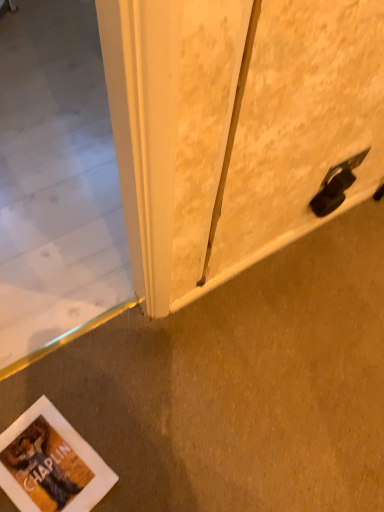
Question: Is white matte concrete at lower left positioned before matte white screen door at right?

Choices:
 (A) yes
 (B) no

Answer: (B)

Question: Would you say matte white screen door at right is part of white matte concrete at lower left's contents?

Choices:
 (A) no
 (B) yes

Answer: (A)

Question: From the image's perspective, is white matte concrete at lower left below matte white screen door at right?

Choices:
 (A) no
 (B) yes

Answer: (B)

Question: Is white matte concrete at lower left not inside matte white screen door at right?

Choices:
 (A) yes
 (B) no

Answer: (A)

Question: Can you confirm if white matte concrete at lower left is smaller than matte white screen door at right?

Choices:
 (A) yes
 (B) no

Answer: (B)

Question: Is white matte concrete at lower left shorter than matte white screen door at right?

Choices:
 (A) yes
 (B) no

Answer: (A)

Question: From the image's perspective, does matte white screen door at right appear higher than white matte concrete at lower left?

Choices:
 (A) yes
 (B) no

Answer: (A)

Question: Considering the relative sizes of matte white screen door at right and white matte concrete at lower left in the image provided, is matte white screen door at right shorter than white matte concrete at lower left?

Choices:
 (A) no
 (B) yes

Answer: (A)

Question: Is matte white screen door at right not near white matte concrete at lower left?

Choices:
 (A) no
 (B) yes

Answer: (A)

Question: Can you confirm if matte white screen door at right is taller than white matte concrete at lower left?

Choices:
 (A) no
 (B) yes

Answer: (B)

Question: From a real-world perspective, is matte white screen door at right positioned over white matte concrete at lower left based on gravity?

Choices:
 (A) yes
 (B) no

Answer: (A)

Question: Is matte white screen door at right looking in the opposite direction of white matte concrete at lower left?

Choices:
 (A) no
 (B) yes

Answer: (A)

Question: Is matte white screen door at right bigger or smaller than white matte concrete at lower left?

Choices:
 (A) small
 (B) big

Answer: (A)